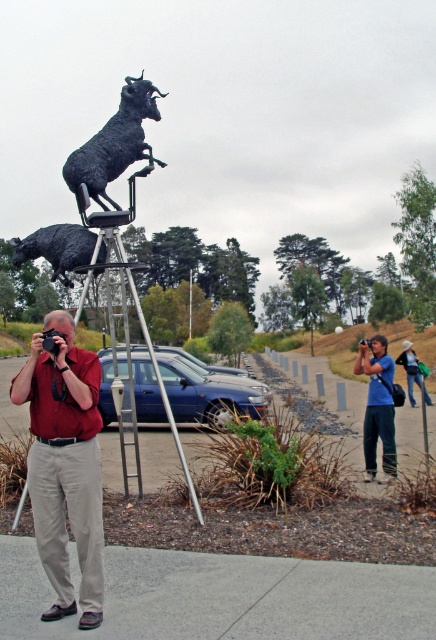
You are a person looking at the sculpture of a goat. You notice two items at the center of your view. Which item is positioned higher up between the khaki pants at center and the blue cotton shirt at center?

The khaki pants at center is located above the blue cotton shirt at center, so it is positioned higher up.

You are an artist trying to paint the scene. You have two items in your bag, khaki pants at center and blue cotton shirt at center. Which item should you choose to place in your painting to fill the foreground better?

The khaki pants at center has a larger size compared to the blue cotton shirt at center, so it would be better to choose the khaki pants at center to fill the foreground better.